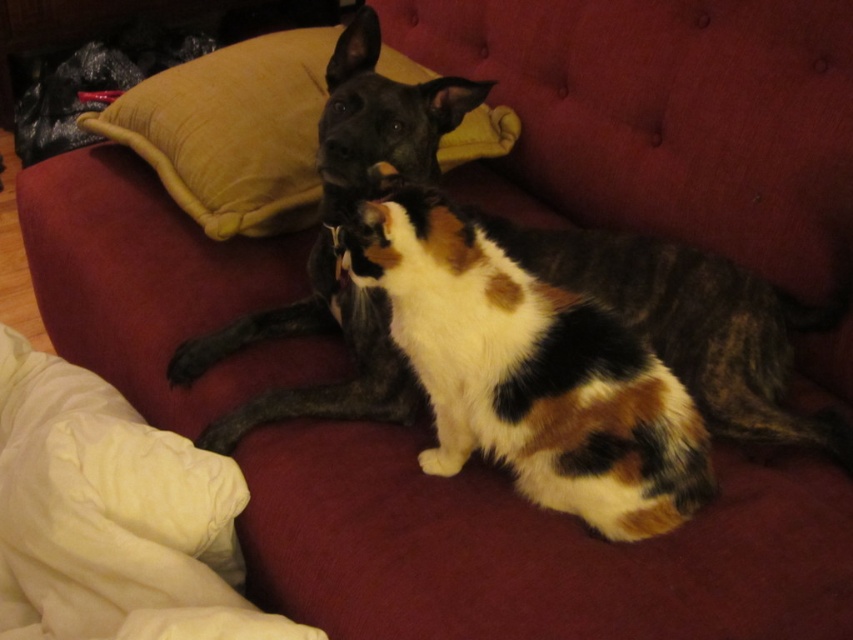
Question: Is calico fur cat at center to the left of velvet yellow pillow at upper center from the viewer's perspective?

Choices:
 (A) no
 (B) yes

Answer: (A)

Question: Can you confirm if calico fur cat at center is thinner than velvet yellow pillow at upper center?

Choices:
 (A) no
 (B) yes

Answer: (B)

Question: Which point appears farthest from the camera in this image?

Choices:
 (A) (398, 80)
 (B) (583, 444)

Answer: (A)

Question: Which of the following is the farthest from the observer?

Choices:
 (A) (125, 102)
 (B) (386, 225)

Answer: (A)

Question: Does calico fur cat at center have a greater width compared to velvet yellow pillow at upper center?

Choices:
 (A) no
 (B) yes

Answer: (A)